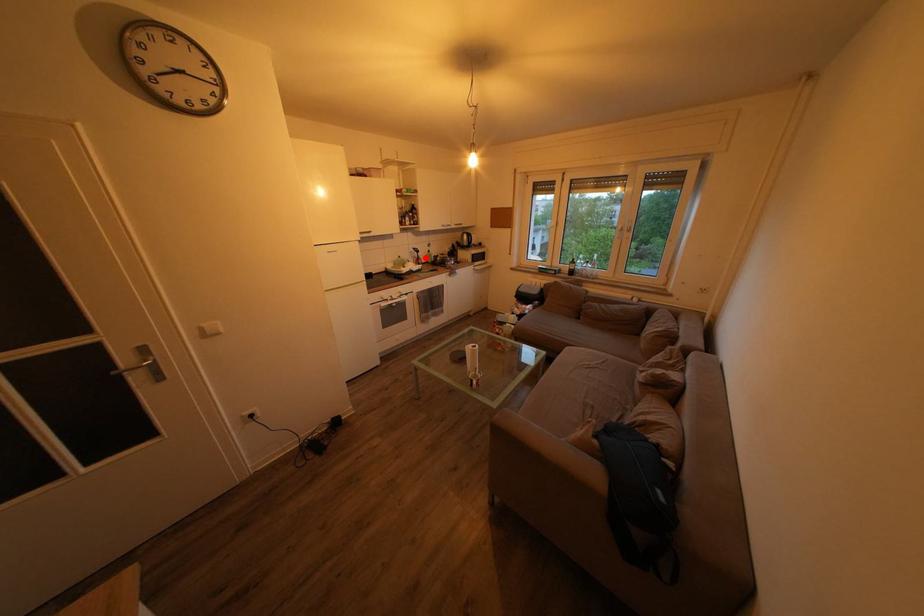
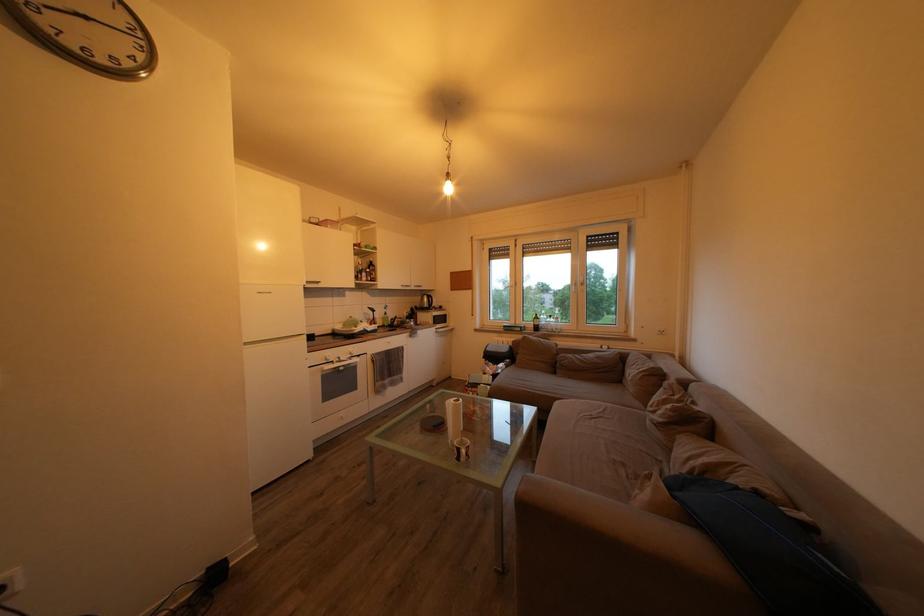
Question: I am providing you with two images of the same scene from different viewpoints. A red point is shown in image1. For the corresponding object point in image2, is it positioned nearer or farther from the camera?

Choices:
 (A) Nearer
 (B) Farther

Answer: (B)